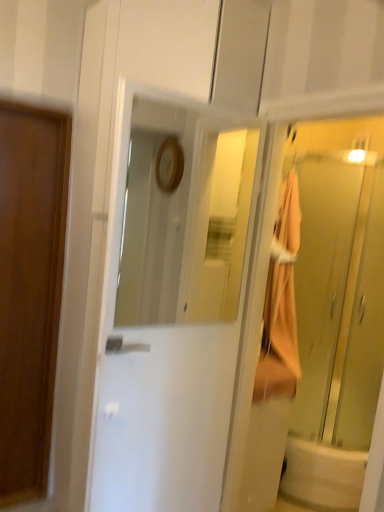
Question: Could you tell me if white glossy door at center, the 1th door when ordered from front to back, is facing translucent glass elevator at right?

Choices:
 (A) yes
 (B) no

Answer: (B)

Question: Is white glossy door at center, acting as the second door starting from the back, not close to translucent glass elevator at right?

Choices:
 (A) yes
 (B) no

Answer: (B)

Question: Is translucent glass elevator at right inside white glossy door at center, placed as the 2th door when sorted from left to right?

Choices:
 (A) no
 (B) yes

Answer: (A)

Question: Is translucent glass elevator at right at the back of white glossy door at center, placed as the 2th door when sorted from left to right?

Choices:
 (A) yes
 (B) no

Answer: (B)

Question: Considering the relative sizes of white glossy door at center, placed as the 2th door when sorted from left to right, and translucent glass elevator at right in the image provided, is white glossy door at center, placed as the 2th door when sorted from left to right, bigger than translucent glass elevator at right?

Choices:
 (A) no
 (B) yes

Answer: (A)

Question: Can you confirm if white glossy door at center, the 1th door when ordered from front to back, is positioned to the left of translucent glass elevator at right?

Choices:
 (A) no
 (B) yes

Answer: (B)

Question: Considering the relative positions of translucent glass elevator at right and white glossy bathtub at lower right in the image provided, is translucent glass elevator at right to the right of white glossy bathtub at lower right from the viewer's perspective?

Choices:
 (A) yes
 (B) no

Answer: (B)

Question: Can you confirm if translucent glass elevator at right is thinner than white glossy bathtub at lower right?

Choices:
 (A) no
 (B) yes

Answer: (B)

Question: Is translucent glass elevator at right further to the viewer compared to white glossy bathtub at lower right?

Choices:
 (A) no
 (B) yes

Answer: (A)

Question: Is translucent glass elevator at right bigger than white glossy bathtub at lower right?

Choices:
 (A) no
 (B) yes

Answer: (B)

Question: Considering the relative sizes of translucent glass elevator at right and white glossy bathtub at lower right in the image provided, is translucent glass elevator at right shorter than white glossy bathtub at lower right?

Choices:
 (A) no
 (B) yes

Answer: (A)

Question: From the image's perspective, is translucent glass elevator at right above white glossy bathtub at lower right?

Choices:
 (A) yes
 (B) no

Answer: (A)

Question: From the image's perspective, would you say white glossy bathtub at lower right is positioned over white glossy door at center, the 1th door from the right?

Choices:
 (A) no
 (B) yes

Answer: (A)